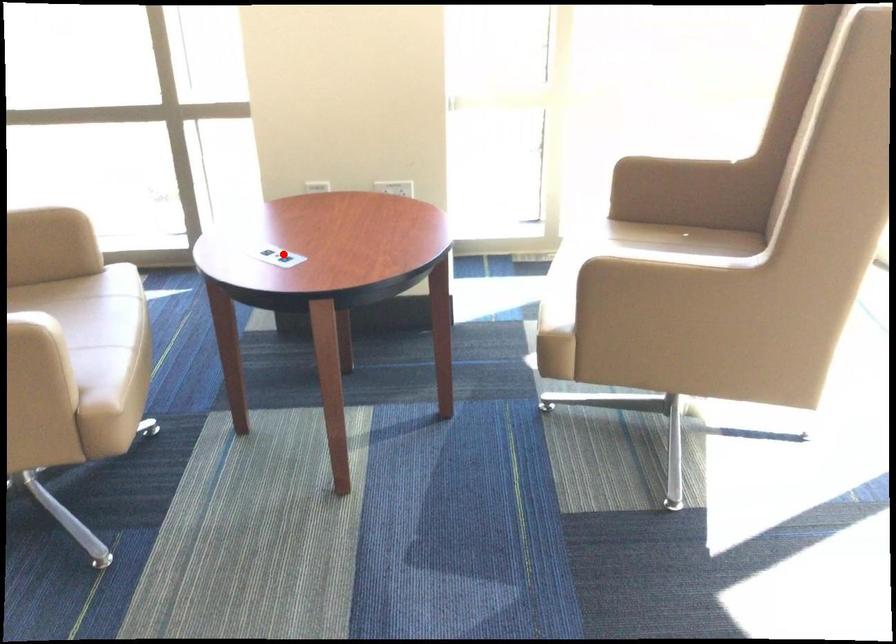
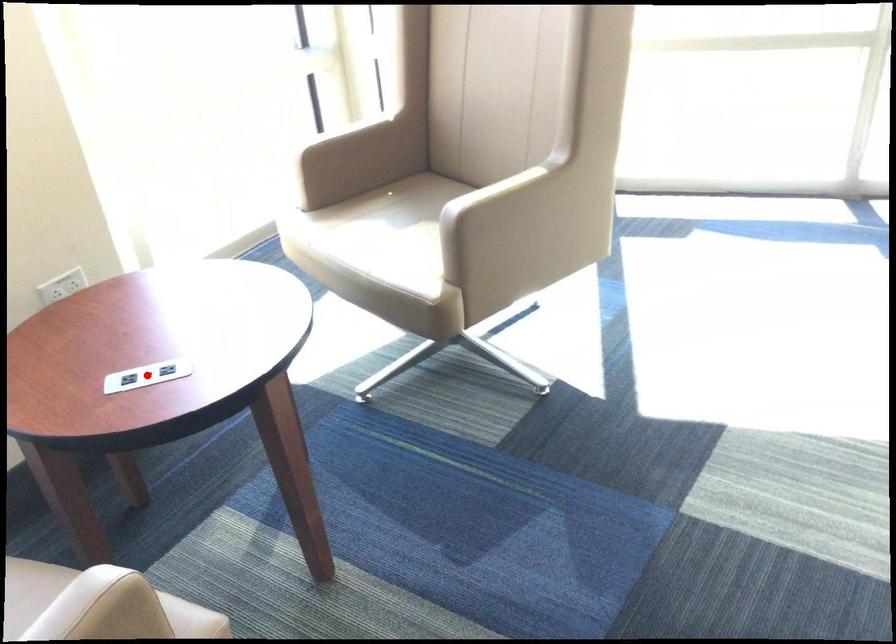
I am providing you with two images of the same scene from different viewpoints. A red point is marked on the first image and another point is marked on the second image. Is the marked point in image1 the same physical position as the marked point in image2?

Yes